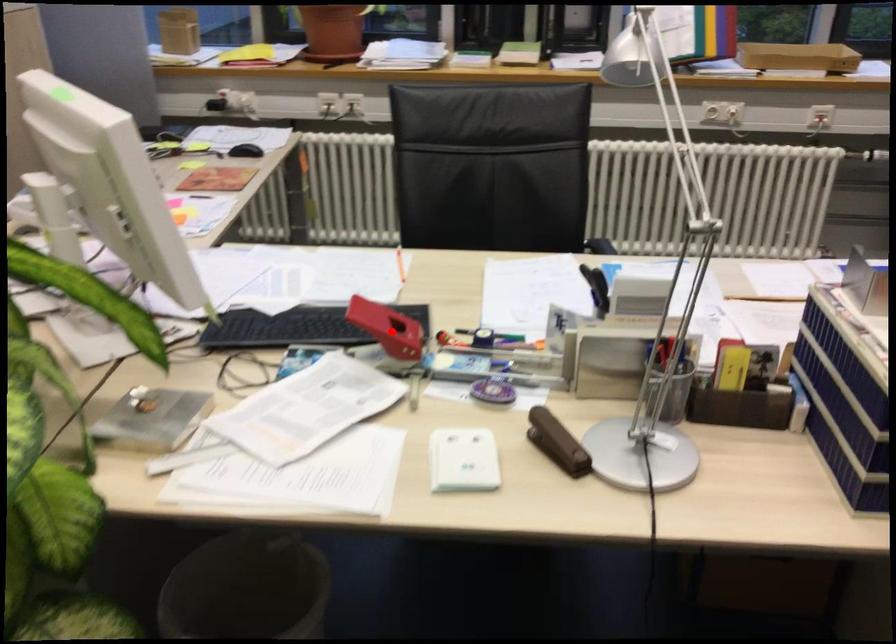
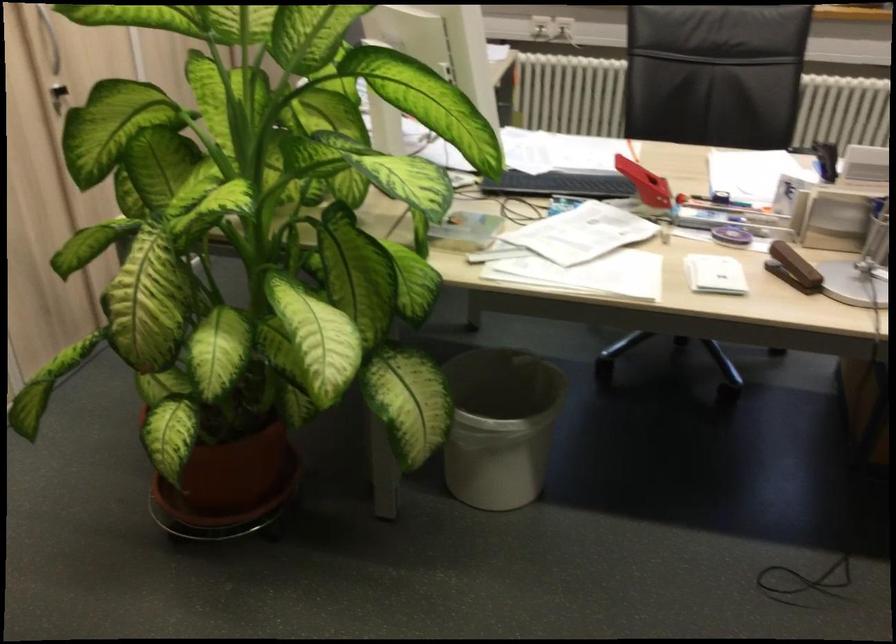
Question: I am providing you with two images of the same scene from different viewpoints. Given a red point in image1, look at the same physical point in image2. Is it:

Choices:
 (A) Closer to the viewpoint
 (B) Farther from the viewpoint

Answer: (B)